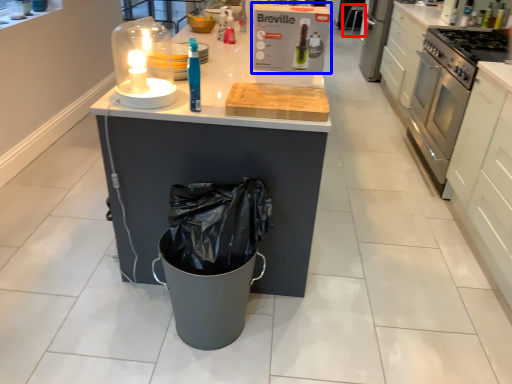
Question: Which object is further to the camera taking this photo, bar stool (highlighted by a red box) or kitchen appliance (highlighted by a blue box)?

Choices:
 (A) bar stool
 (B) kitchen appliance

Answer: (A)